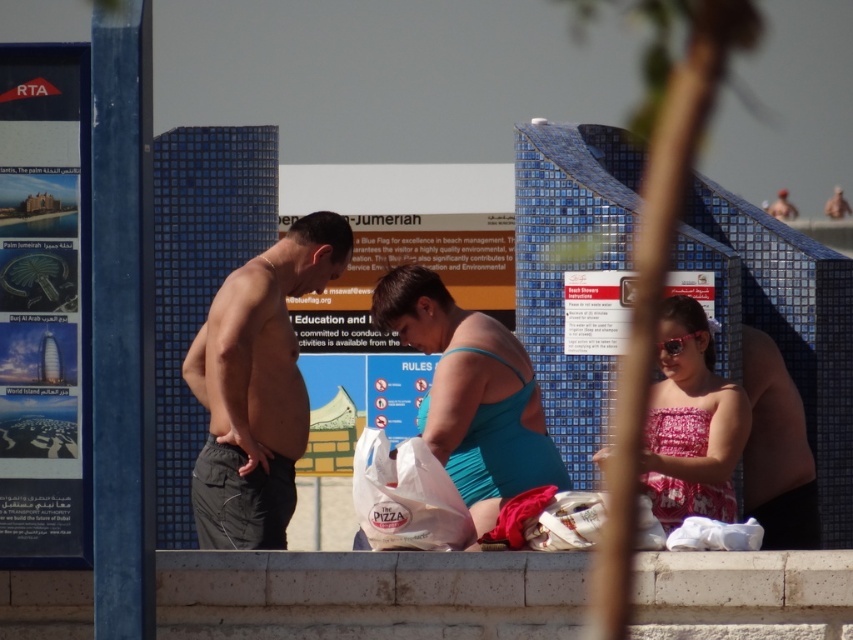
Can you confirm if gray fabric shorts at left is shorter than smooth skin torso at center?

Correct, gray fabric shorts at left is not as tall as smooth skin torso at center.

Who is lower down, gray fabric shorts at left or smooth skin torso at center?

gray fabric shorts at left

Who is more distant from viewer, (229, 444) or (804, 432)?

The point (804, 432) is behind.

Locate an element on the screen. The height and width of the screenshot is (640, 853). gray fabric shorts at left is located at coordinates (257, 387).

Between teal fabric swimsuit at center and smooth skin torso at center, which one is positioned higher?

teal fabric swimsuit at center

Does teal fabric swimsuit at center have a greater width compared to smooth skin torso at center?

Indeed, teal fabric swimsuit at center has a greater width compared to smooth skin torso at center.

Is point (421, 301) farther from camera compared to point (787, 531)?

No.

This screenshot has width=853, height=640. I want to click on teal fabric swimsuit at center, so click(471, 394).

Does smooth skin torso at center lie behind white plastic bag at center?

Yes.

Can you confirm if smooth skin torso at center is smaller than white plastic bag at center?

Actually, smooth skin torso at center might be larger than white plastic bag at center.

Who is more forward, (770, 531) or (393, 486)?

Positioned in front is point (393, 486).

Where is `smooth skin torso at center`? This screenshot has width=853, height=640. smooth skin torso at center is located at coordinates (776, 451).